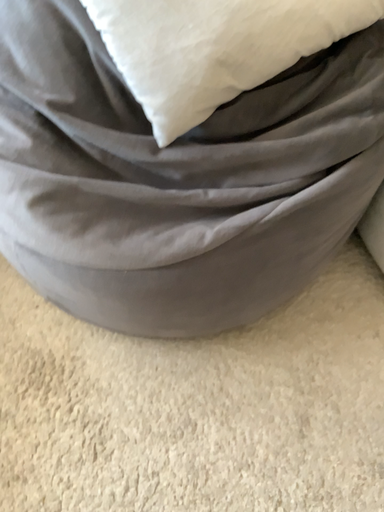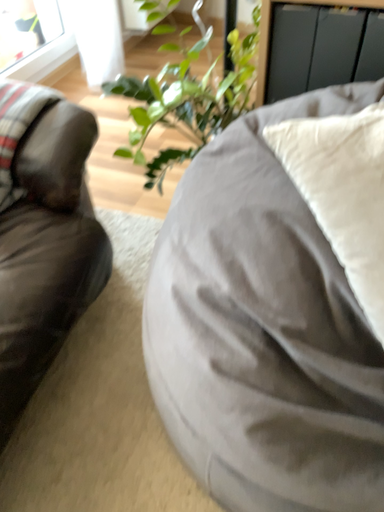
Question: How did the camera likely rotate when shooting the video?

Choices:
 (A) rotated right
 (B) rotated left

Answer: (B)